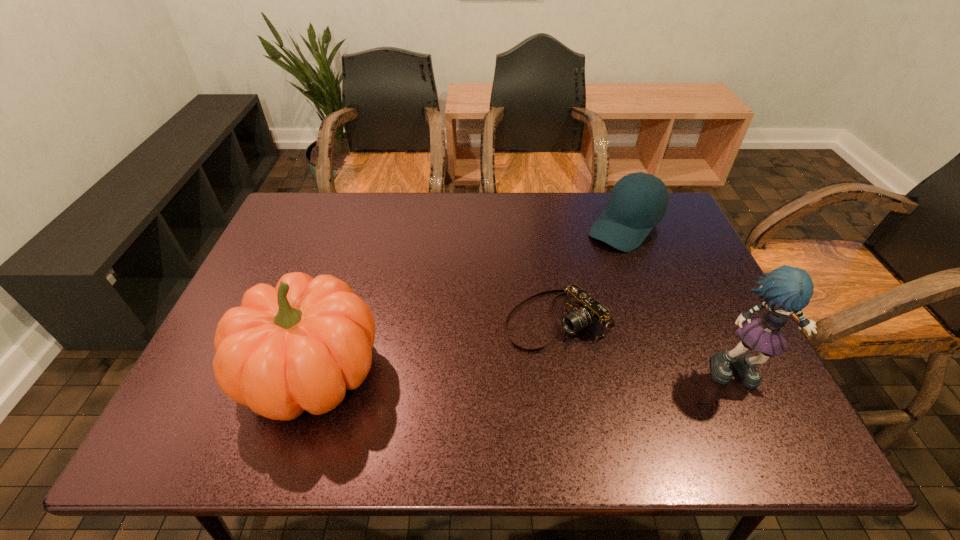
At what (x,y) coordinates should I click in order to perform the action: click on vacant space on the desktop that is between the leftmost object and the rag doll and is positioned on the front-facing side of the shortest object. Please return your answer as a coordinate pair (x, y). This screenshot has width=960, height=540. Looking at the image, I should click on (463, 373).

Identify the location of vacant space on the desktop that is between the pumpkin and the rag doll and is positioned on the front-facing side of the second shortest object. [472, 373].